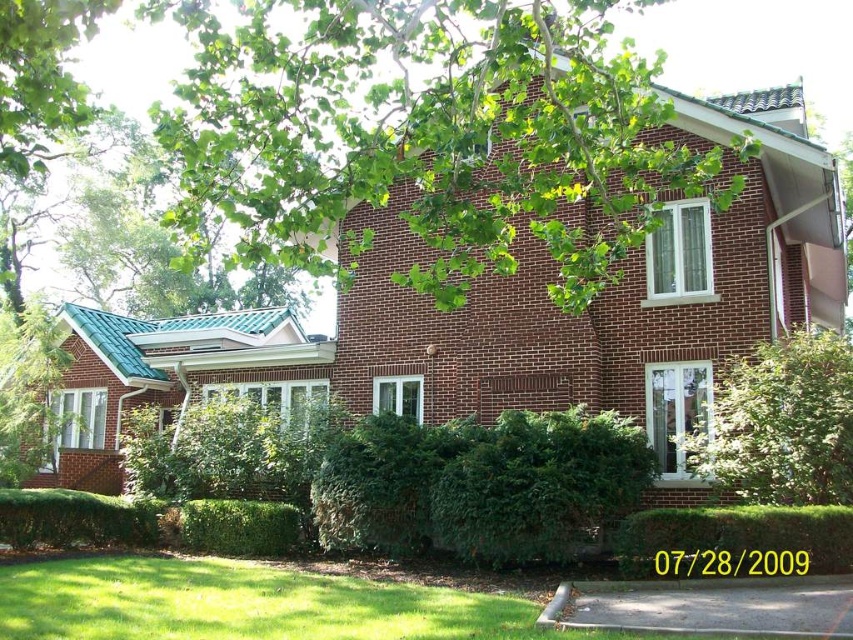
Question: Which point is farther to the camera?

Choices:
 (A) (741, 440)
 (B) (517, 140)
 (C) (724, 561)
 (D) (642, 435)

Answer: (B)

Question: Can you confirm if green leafy bush at lower center is positioned above green leafy hedge at center?

Choices:
 (A) no
 (B) yes

Answer: (B)

Question: Does green leafy bush at lower center appear on the left side of green leafy hedge at center?

Choices:
 (A) no
 (B) yes

Answer: (B)

Question: Which object is closer to the camera taking this photo?

Choices:
 (A) green leafy tree at upper center
 (B) green leafy bush at lower center
 (C) green leafy bush at center

Answer: (A)

Question: Which object is positioned farthest from the green leafy tree at upper center?

Choices:
 (A) green leafy hedge at center
 (B) green leafy bush at center

Answer: (A)

Question: Is green leafy bush at center smaller than green leafy hedge at center?

Choices:
 (A) no
 (B) yes

Answer: (A)